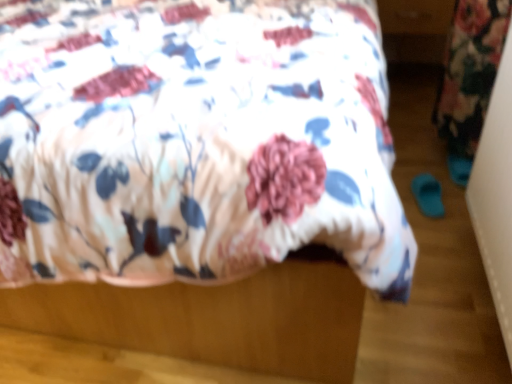
In order to face floral fabric bed at center, should I rotate leftwards or rightwards?

Turn left approximately 12.354 degrees to face it.

What do you see at coordinates (195, 142) in the screenshot? I see `floral fabric bed at center` at bounding box center [195, 142].

You are a GUI agent. You are given a task and a screenshot of the screen. Output one action in this format:
    pyautogui.click(x=<x>, y=<y>)
    Task: Click on the floral fabric bed at center
    This screenshot has width=512, height=384.
    Given the screenshot: What is the action you would take?
    pyautogui.click(x=195, y=142)

Locate an element on the screen. This screenshot has width=512, height=384. floral fabric bed at center is located at coordinates (195, 142).